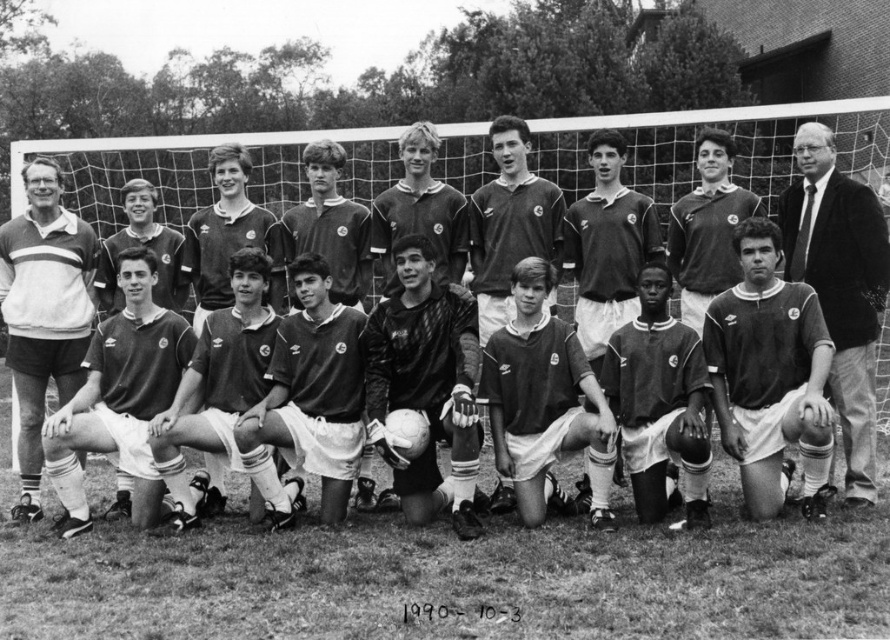
You are a photographer trying to capture a clear shot of both the dark blue jersey at center and the dark green jersey at center during a soccer match. Based on their sizes in the photo, which jersey should you focus on first to ensure it fits within your camera frame?

The dark blue jersey at center is larger in size than the dark green jersey at center, so you should focus on the dark blue jersey at center first to ensure it fits within your camera frame.

You are a photographer standing at the edge of the soccer field. You notice two points marked in the image. The first point is at coordinates point (458,509) and the second is at point (63,486). Which point is nearer to your position?

Point (458,509) is closer to the viewer than point (63,486).